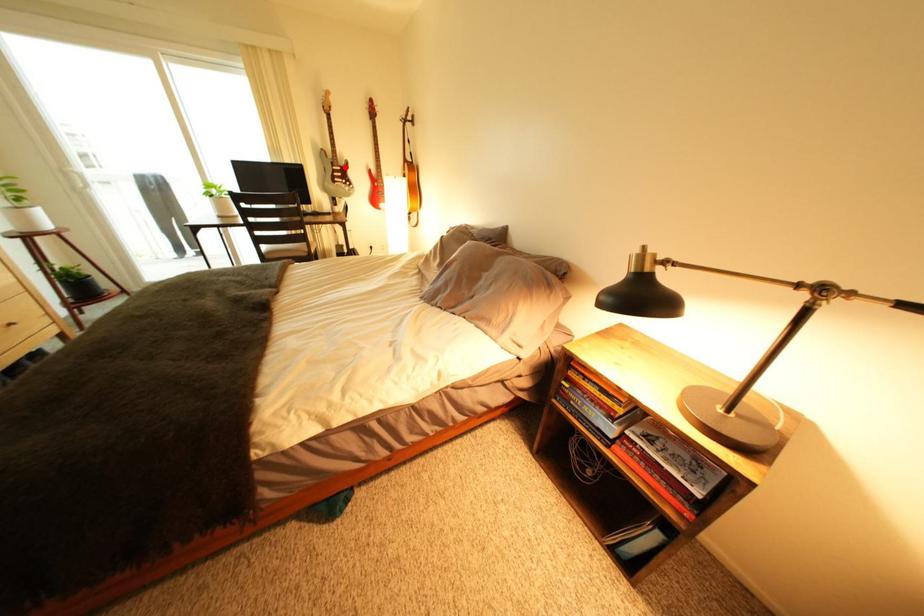
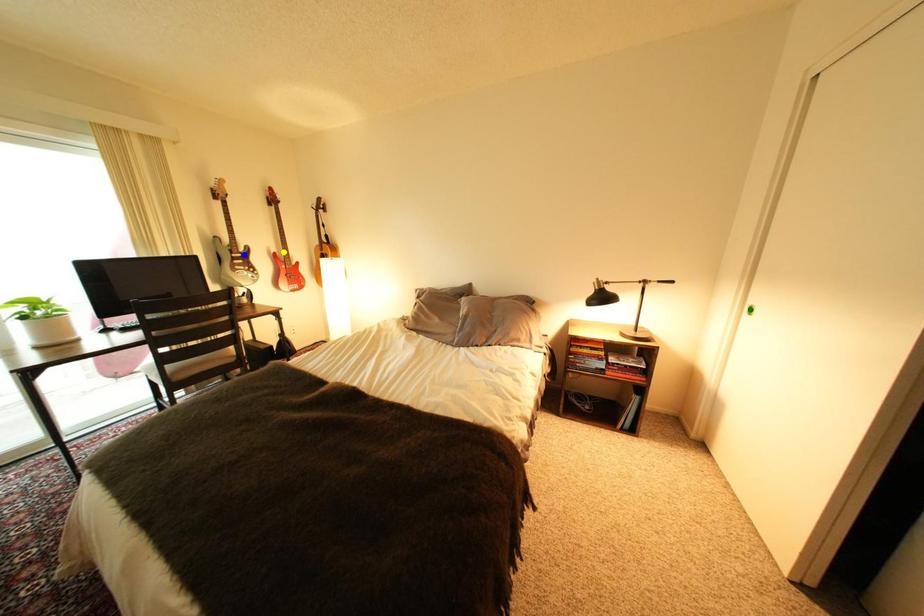
Question: I am providing you with two images of the same scene from different viewpoints. A red point is marked on the first image. You are given multiple points on the second image. Which mark in image 2 goes with the point in image 1?

Choices:
 (A) green point
 (B) blue point
 (C) yellow point

Answer: (B)